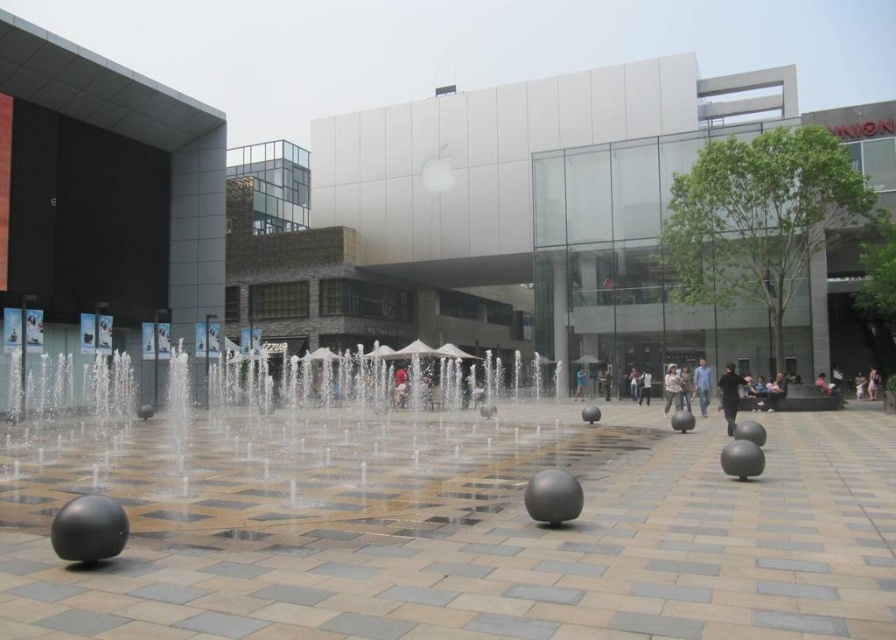
You are standing at the origin point of the plaza coordinate system. You want to reach the matte white building at center. What are the coordinates you need to move to?

The coordinates you need to move to are point (x=554, y=188).

You are a delivery person carrying a package that is 10 cm thick. You see the blue denim shirt at center and the light brown fabric bag at lower right. Which item can your package fit between without overlapping?

The blue denim shirt at center is thinner than the light brown fabric bag at lower right, so the package can fit between the blue denim shirt at center and the light brown fabric bag at lower right if the space between them accommodates the package.